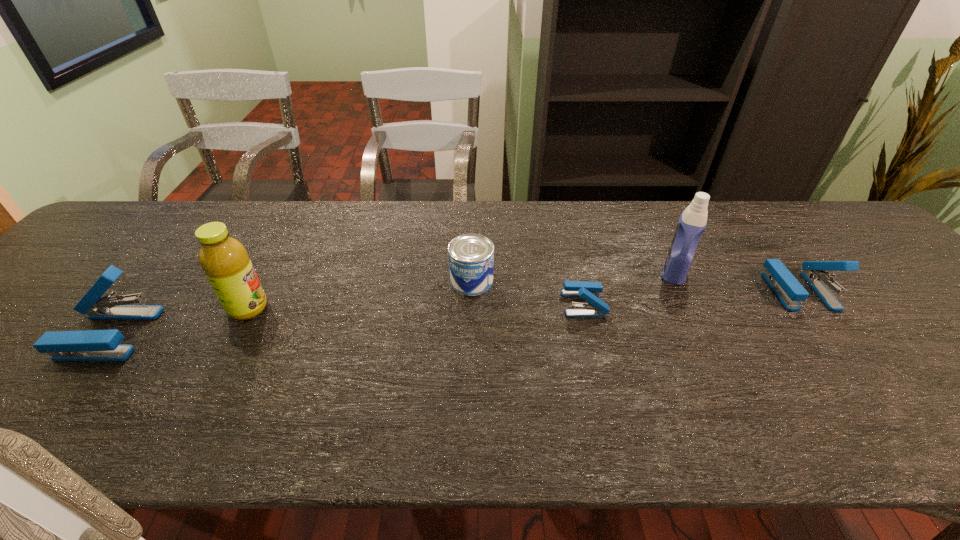
Locate an element on the screen. Image resolution: width=960 pixels, height=540 pixels. free area in between the fruit juice and the leftmost object is located at coordinates (179, 321).

Locate an element on the screen. vacant point located between the detergent and the fourth object from right to left is located at coordinates (573, 276).

Where is `empty location between the third object from right to left and the can`? empty location between the third object from right to left and the can is located at coordinates (528, 292).

I want to click on vacant space in between the leftmost object and the shortest object, so click(x=347, y=319).

This screenshot has height=540, width=960. Identify the location of empty space between the second object from right to left and the third object from left to right. (573, 276).

Find the location of `unoccupied position between the second object from right to left and the rightmost object`. unoccupied position between the second object from right to left and the rightmost object is located at coordinates (736, 281).

The height and width of the screenshot is (540, 960). Find the location of `vacant space that is in between the leftmost object and the shortest object`. vacant space that is in between the leftmost object and the shortest object is located at coordinates (347, 319).

Locate an element on the screen. The height and width of the screenshot is (540, 960). vacant space in between the fifth object from right to left and the second stapler from left to right is located at coordinates (416, 306).

The width and height of the screenshot is (960, 540). Find the location of `free area in between the leftmost stapler and the third object from left to right`. free area in between the leftmost stapler and the third object from left to right is located at coordinates (290, 307).

Identify which object is the fourth nearest to the detergent. Please provide its 2D coordinates. Your answer should be formatted as a tuple, i.e. [(x, y)], where the tuple contains the x and y coordinates of a point satisfying the conditions above.

[(225, 261)]